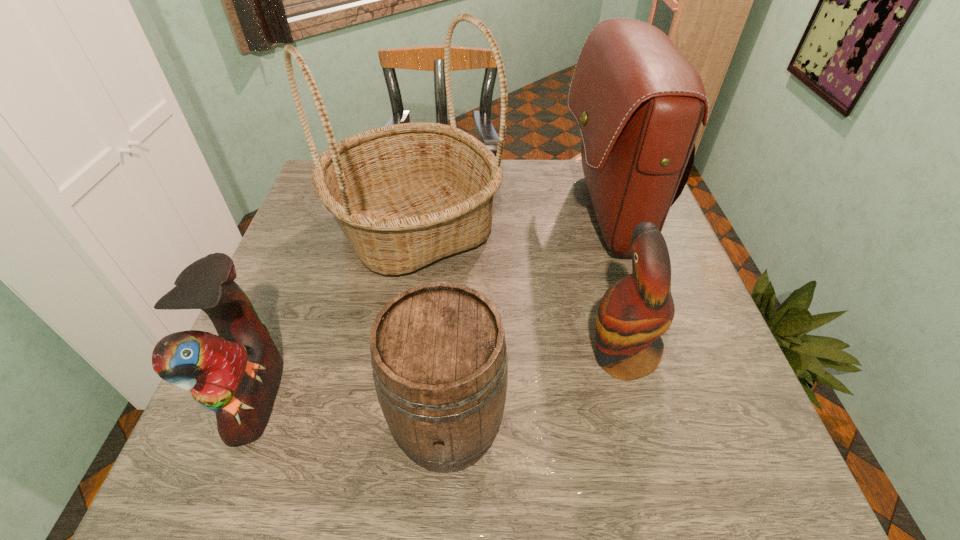
At what (x,y) coordinates should I click in order to perform the action: click on empty location between the cider and the left parrot. Please return your answer as a coordinate pair (x, y). Image resolution: width=960 pixels, height=540 pixels. Looking at the image, I should click on (351, 411).

Identify the location of empty location between the left parrot and the basket. Image resolution: width=960 pixels, height=540 pixels. (336, 312).

This screenshot has width=960, height=540. Find the location of `free space between the right parrot and the basket`. free space between the right parrot and the basket is located at coordinates (518, 292).

Where is `free space between the right parrot and the basket`? Image resolution: width=960 pixels, height=540 pixels. free space between the right parrot and the basket is located at coordinates (518, 292).

You are a GUI agent. You are given a task and a screenshot of the screen. Output one action in this format:
    pyautogui.click(x=<x>, y=<y>)
    Task: Click on the object that is the second closest to the left parrot
    The height and width of the screenshot is (540, 960).
    Given the screenshot: What is the action you would take?
    pyautogui.click(x=438, y=352)

The image size is (960, 540). I want to click on the closest object to the basket, so click(x=237, y=373).

Identify the location of free spot that satisfies the following two spatial constraints: 1. on the open flap of the satchel; 2. on the side of the cider near the bung hole. (672, 425).

You are a GUI agent. You are given a task and a screenshot of the screen. Output one action in this format:
    pyautogui.click(x=<x>, y=<y>)
    Task: Click on the free spot that satisfies the following two spatial constraints: 1. on the open flap of the satchel; 2. on the side of the cider near the bung hole
    The image size is (960, 540).
    Given the screenshot: What is the action you would take?
    pyautogui.click(x=672, y=425)